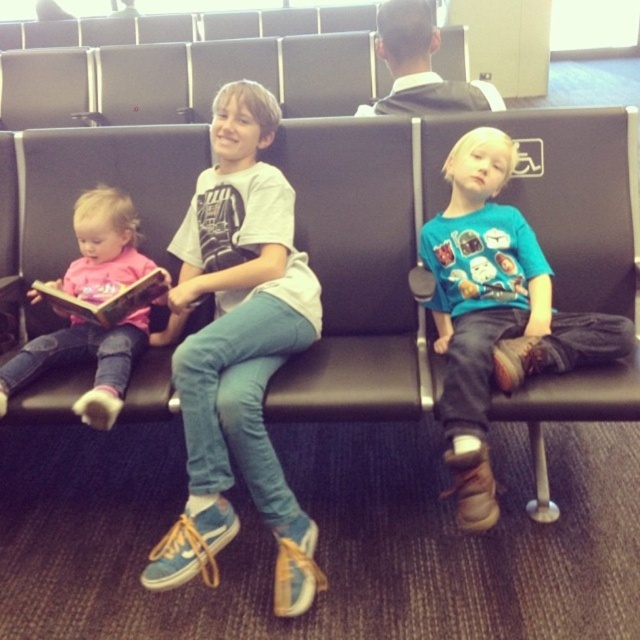
Question: Where is smooth black shirt at center located in relation to hardcover book at left in the image?

Choices:
 (A) below
 (B) above

Answer: (B)

Question: Among these objects, which one is farthest from the camera?

Choices:
 (A) light blue denim jeans at center
 (B) pink fabric shirt at left
 (C) hardcover book at left

Answer: (C)

Question: From the image, what is the correct spatial relationship of light blue denim jeans at center in relation to smooth black shirt at center?

Choices:
 (A) below
 (B) above

Answer: (A)

Question: Which object is positioned farthest from the light blue denim jeans at center?

Choices:
 (A) hardcover book at left
 (B) pink fabric shirt at left
 (C) smooth black shirt at center

Answer: (C)

Question: From the image, what is the correct spatial relationship of light blue denim jeans at center in relation to smooth black shirt at center?

Choices:
 (A) above
 (B) below

Answer: (B)

Question: Which is farther from the smooth black shirt at center?

Choices:
 (A) light blue denim jeans at center
 (B) hardcover book at left

Answer: (B)